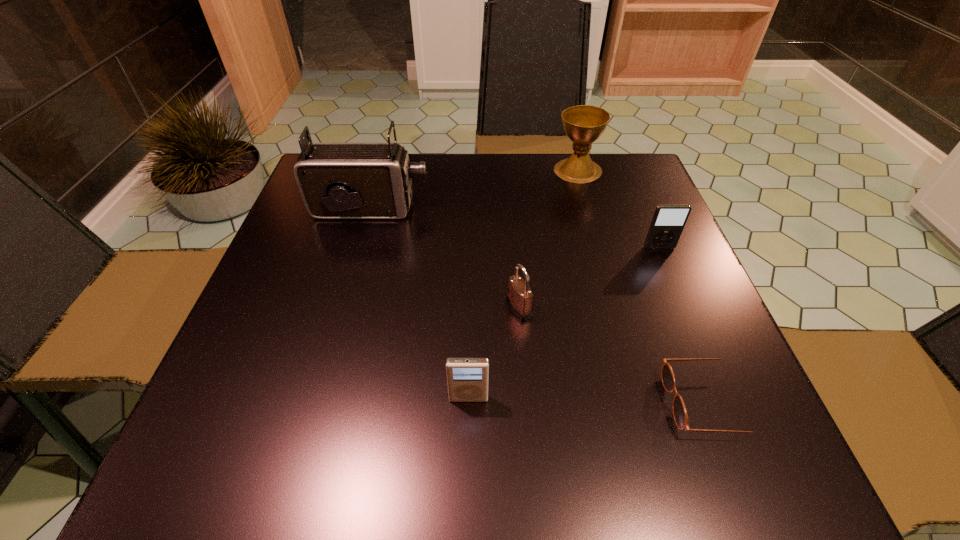
At what (x,y) coordinates should I click in order to perform the action: click on free point between the fifth object from right to left and the tallest object. Please return your answer as a coordinate pair (x, y). Image resolution: width=960 pixels, height=540 pixels. Looking at the image, I should click on (420, 303).

Identify the location of vacant space that's between the fourth object from right to left and the fifth object from right to left. The height and width of the screenshot is (540, 960). (493, 353).

Locate which object ranks fifth in proximity to the nearer iPod. Please provide its 2D coordinates. Your answer should be formatted as a tuple, i.e. [(x, y)], where the tuple contains the x and y coordinates of a point satisfying the conditions above.

[(584, 124)]

Identify the location of object that can be found as the fourth closest to the padlock. This screenshot has width=960, height=540. (668, 222).

Identify the location of vacant area that satisfies the following two spatial constraints: 1. at the lens of the leftmost object; 2. on the back side of the padlock. This screenshot has width=960, height=540. (343, 308).

At what (x,y) coordinates should I click in order to perform the action: click on vacant area that satisfies the following two spatial constraints: 1. on the front-facing side of the farther iPod; 2. on the front-facing side of the shortest object. Please return your answer as a coordinate pair (x, y). Looking at the image, I should click on (724, 402).

At what (x,y) coordinates should I click in order to perform the action: click on vacant space that satisfies the following two spatial constraints: 1. on the front-facing side of the right iPod; 2. on the front-facing side of the shortest object. Please return your answer as a coordinate pair (x, y). Looking at the image, I should click on (724, 402).

This screenshot has height=540, width=960. In order to click on vacant space that satisfies the following two spatial constraints: 1. on the front side of the second tallest object; 2. at the lens of the camcorder in this screenshot , I will do `click(588, 209)`.